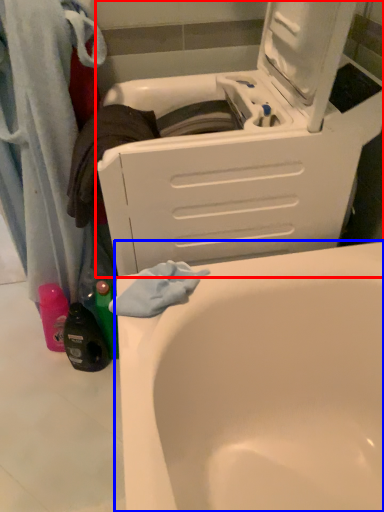
Question: Among these objects, which one is farthest to the camera, washing machine (highlighted by a red box) or bathtub (highlighted by a blue box)?

Choices:
 (A) washing machine
 (B) bathtub

Answer: (B)